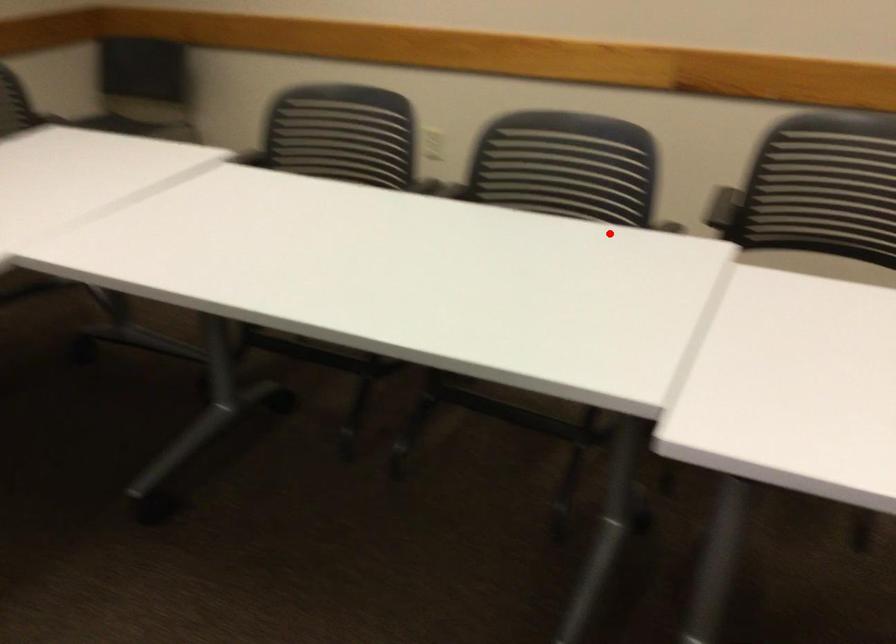
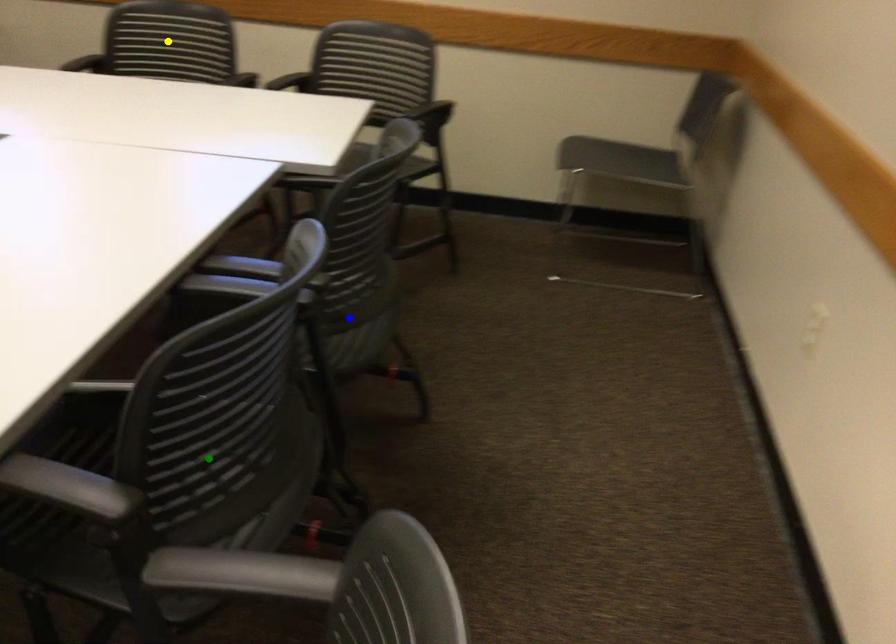
Question: I am providing you with two images of the same scene from different viewpoints. A red point is marked on the first image. You are given multiple points on the second image. Which point in image 2 is actually the same real-world point as the red point in image 1?

Choices:
 (A) yellow point
 (B) blue point
 (C) green point

Answer: (C)